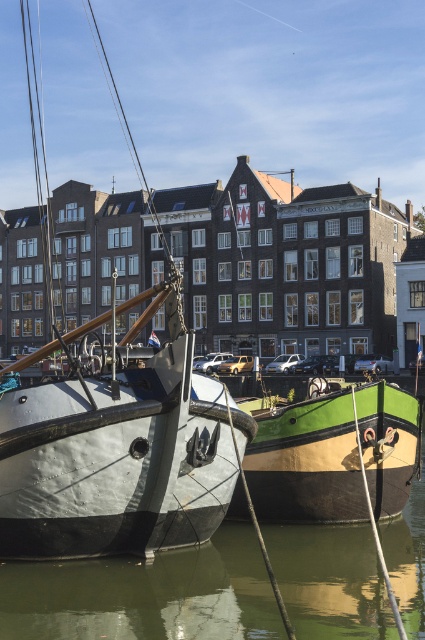
Who is higher up, green rubber boat at center or green matte boat at center?

green matte boat at center is higher up.

In the scene shown: Who is positioned more to the left, green rubber boat at center or green matte boat at center?

From the viewer's perspective, green matte boat at center appears more on the left side.

Where is `green rubber boat at center`? Image resolution: width=425 pixels, height=640 pixels. green rubber boat at center is located at coordinates (146, 595).

Who is lower down, matte black boat at left or green rubber boat at center?

green rubber boat at center is below.

The width and height of the screenshot is (425, 640). Identify the location of matte black boat at left. (116, 440).

What are the coordinates of `matte black boat at left` in the screenshot? It's located at (116, 440).

Between matte black boat at left and green matte boat at center, which one has less height?

Standing shorter between the two is green matte boat at center.

Looking at this image, between matte black boat at left and green matte boat at center, which one is positioned lower?

green matte boat at center is below.

Is point (206, 490) closer to viewer compared to point (404, 410)?

Yes, point (206, 490) is closer to viewer.

At what (x,y) coordinates should I click in order to perform the action: click on matte black boat at left. Please return your answer as a coordinate pair (x, y). This screenshot has width=425, height=640. Looking at the image, I should click on (116, 440).